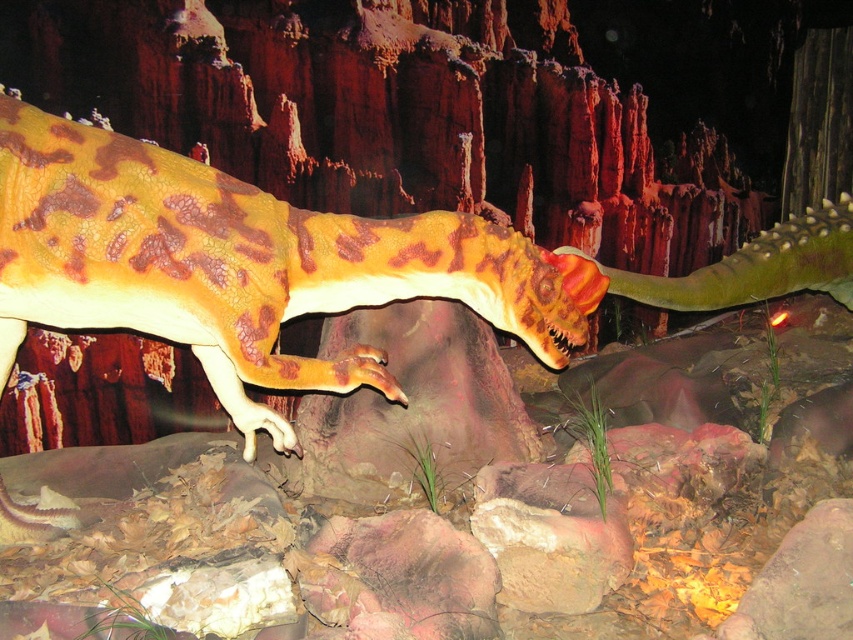
Which is behind, point (265, 208) or point (728, 616)?

Positioned behind is point (265, 208).

Does camouflage plastic dinosaur at center appear over rustic stone at lower right?

Yes, camouflage plastic dinosaur at center is above rustic stone at lower right.

Which is behind, point (558, 353) or point (805, 588)?

The point (558, 353) is more distant.

What are the coordinates of `camouflage plastic dinosaur at center` in the screenshot? It's located at (244, 266).